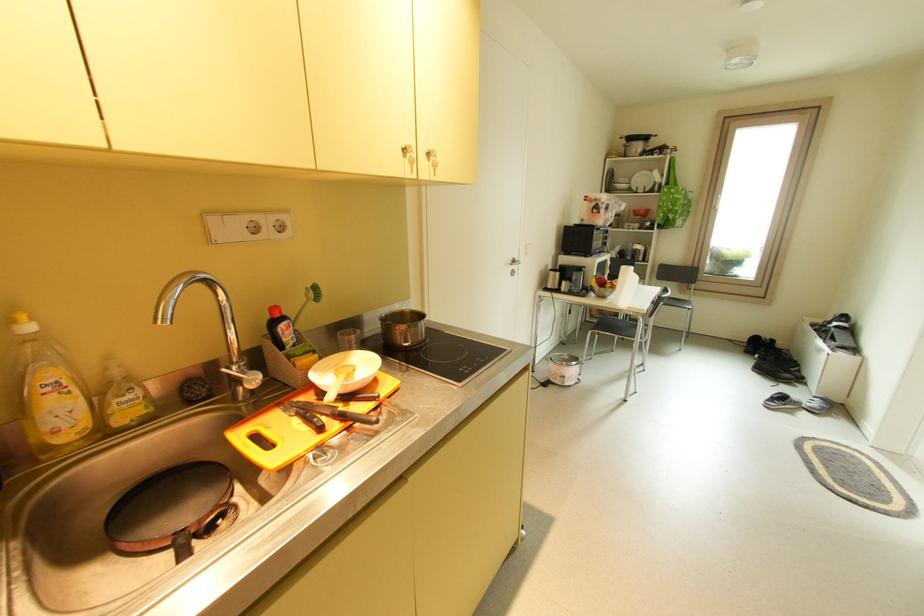
Where is `black pot lid handle`? This screenshot has height=616, width=924. black pot lid handle is located at coordinates (181, 545).